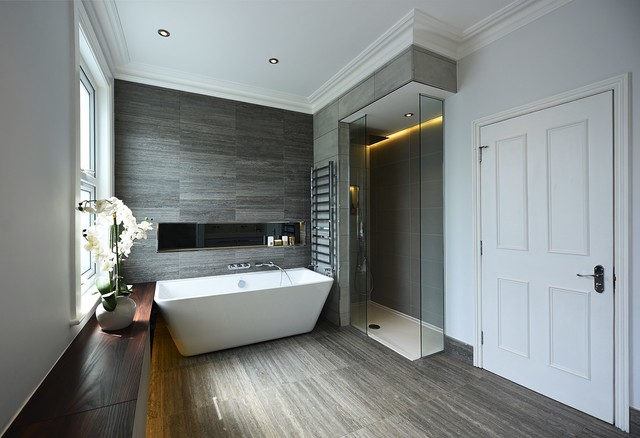
Find the location of a particular element. white door is located at coordinates (537, 266).